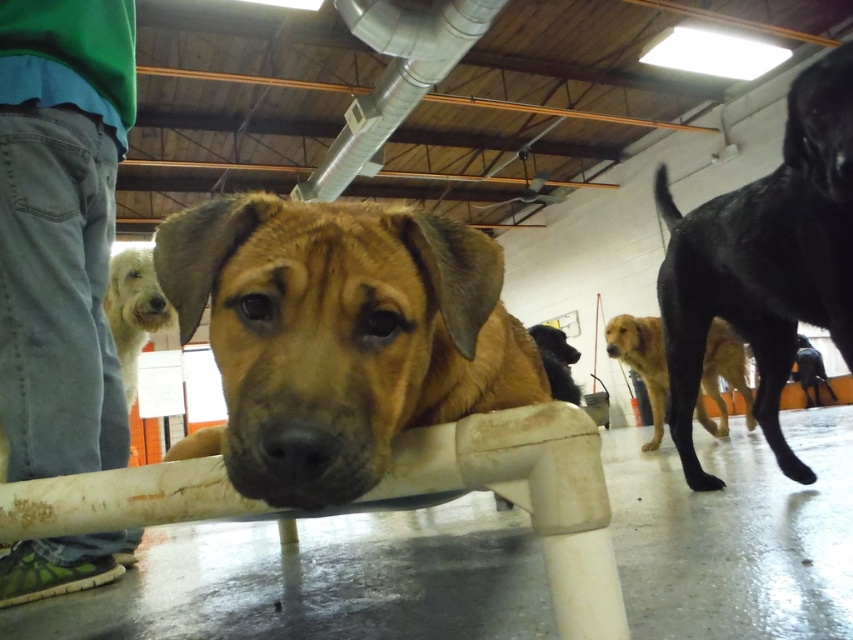
You are a security guard in a warehouse and you see the green denim pants at left and the brown matte dog at center. Which object takes up more horizontal space in the image?

The brown matte dog at center takes up more horizontal space than the green denim pants at left because the green denim pants at left has a lesser width compared to brown matte dog at center.

Based on the photo, you are standing in the warehouse and see the brown furry dog at center and the golden brown fur at center. Which one is positioned to the left?

The brown furry dog at center is positioned to the left of the golden brown fur at center.

In the scene shown: You are standing in the warehouse and see a point marked at coordinates (61,228). What object is this point located on?

The point at coordinates (61,228) is located on the green denim pants at left.